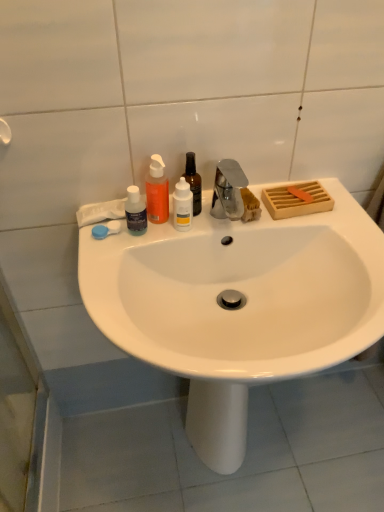
This screenshot has height=512, width=384. Find the location of `transparent plastic bottle at center, arranged as the 4th bottle when viewed from the left`. transparent plastic bottle at center, arranged as the 4th bottle when viewed from the left is located at coordinates [193, 182].

This screenshot has height=512, width=384. Describe the element at coordinates (193, 182) in the screenshot. I see `transparent plastic bottle at center, the first bottle in the right-to-left sequence` at that location.

Looking at this image, how much space does white matte bottle at center, which is counted as the 3th bottle, starting from the left, occupy horizontally?

white matte bottle at center, which is counted as the 3th bottle, starting from the left, is 1.67 inches wide.

Measure the distance between white glossy sink at center and camera.

white glossy sink at center is 59.67 centimeters away from camera.

What is the approximate width of matte black bottle at left, the 4th bottle positioned from the right?

matte black bottle at left, the 4th bottle positioned from the right, is 1.65 inches in width.

This screenshot has width=384, height=512. What are the coordinates of `blue plastic soap at left` in the screenshot? It's located at (106, 229).

Looking at this image, is white matte bottle at center, which is counted as the 3th bottle, starting from the left, positioned far away from translucent orange liquid at upper center, which is counted as the second bottle, starting from the left?

No, white matte bottle at center, which is counted as the 3th bottle, starting from the left, is not far away from translucent orange liquid at upper center, which is counted as the second bottle, starting from the left.

Is white matte bottle at center, which is counted as the 3th bottle, starting from the left, smaller than translucent orange liquid at upper center, which is counted as the second bottle, starting from the left?

Yes, white matte bottle at center, which is counted as the 3th bottle, starting from the left, is smaller than translucent orange liquid at upper center, which is counted as the second bottle, starting from the left.

Does white matte bottle at center, which is counted as the 3th bottle, starting from the left, appear on the right side of translucent orange liquid at upper center, which is counted as the second bottle, starting from the left?

Yes, white matte bottle at center, which is counted as the 3th bottle, starting from the left, is to the right of translucent orange liquid at upper center, which is counted as the second bottle, starting from the left.

From the image's perspective, which one is positioned higher, white matte bottle at center, which is counted as the second bottle, starting from the right, or translucent orange liquid at upper center, which is the third bottle in right-to-left order?

From the image's view, translucent orange liquid at upper center, which is the third bottle in right-to-left order, is above.

Is white glossy sink at center positioned beyond the bounds of white matte bottle at center, which is counted as the second bottle, starting from the right?

Yes, white glossy sink at center is located beyond the bounds of white matte bottle at center, which is counted as the second bottle, starting from the right.

In terms of width, does white glossy sink at center look wider or thinner when compared to white matte bottle at center, which is counted as the second bottle, starting from the right?

Clearly, white glossy sink at center has more width compared to white matte bottle at center, which is counted as the second bottle, starting from the right.

From a real-world perspective, is white glossy sink at center physically above white matte bottle at center, which is counted as the second bottle, starting from the right?

Actually, white glossy sink at center is physically below white matte bottle at center, which is counted as the second bottle, starting from the right, in the real world.

Considering the sizes of objects white glossy sink at center and white matte bottle at center, which is counted as the second bottle, starting from the right, in the image provided, who is taller, white glossy sink at center or white matte bottle at center, which is counted as the second bottle, starting from the right,?

With more height is white glossy sink at center.

Can you confirm if matte black bottle at left, the 4th bottle positioned from the right, is positioned to the right of transparent plastic bottle at center, arranged as the 4th bottle when viewed from the left?

No, matte black bottle at left, the 4th bottle positioned from the right, is not to the right of transparent plastic bottle at center, arranged as the 4th bottle when viewed from the left.

Is matte black bottle at left, which is the 1th bottle in left-to-right order, behind transparent plastic bottle at center, the first bottle in the right-to-left sequence?

No, matte black bottle at left, which is the 1th bottle in left-to-right order, is closer to the viewer.

In the scene shown: Considering the relative sizes of matte black bottle at left, which is the 1th bottle in left-to-right order, and transparent plastic bottle at center, the first bottle in the right-to-left sequence, in the image provided, is matte black bottle at left, which is the 1th bottle in left-to-right order, smaller than transparent plastic bottle at center, the first bottle in the right-to-left sequence,?

Yes.

From the picture: Can you confirm if blue plastic soap at left is shorter than white matte bottle at center, which is counted as the second bottle, starting from the right?

Yes.

Which of these two, blue plastic soap at left or white matte bottle at center, which is counted as the second bottle, starting from the right, is thinner?

blue plastic soap at left.

Are blue plastic soap at left and white matte bottle at center, which is counted as the 3th bottle, starting from the left, far apart?

No, there isn't a large distance between blue plastic soap at left and white matte bottle at center, which is counted as the 3th bottle, starting from the left.

Considering the relative sizes of blue plastic soap at left and white matte bottle at center, which is counted as the second bottle, starting from the right, in the image provided, is blue plastic soap at left smaller than white matte bottle at center, which is counted as the second bottle, starting from the right,?

Indeed, blue plastic soap at left has a smaller size compared to white matte bottle at center, which is counted as the second bottle, starting from the right.

Which object is further away from the camera taking this photo, blue plastic soap at left or matte black bottle at left, which is the 1th bottle in left-to-right order?

blue plastic soap at left.

Is blue plastic soap at left facing away from matte black bottle at left, the 4th bottle positioned from the right?

blue plastic soap at left is not turned away from matte black bottle at left, the 4th bottle positioned from the right.

Is blue plastic soap at left wider or thinner than matte black bottle at left, the 4th bottle positioned from the right?

blue plastic soap at left is thinner than matte black bottle at left, the 4th bottle positioned from the right.

From a real-world perspective, is blue plastic soap at left on matte black bottle at left, the 4th bottle positioned from the right?

Actually, blue plastic soap at left is physically below matte black bottle at left, the 4th bottle positioned from the right, in the real world.

Is there a large distance between matte black bottle at left, which is the 1th bottle in left-to-right order, and blue plastic soap at left?

No.

Relative to blue plastic soap at left, is matte black bottle at left, the 4th bottle positioned from the right, in front or behind?

matte black bottle at left, the 4th bottle positioned from the right, is in front of blue plastic soap at left.

Is matte black bottle at left, which is the 1th bottle in left-to-right order, positioned with its back to blue plastic soap at left?

matte black bottle at left, which is the 1th bottle in left-to-right order, does not have its back to blue plastic soap at left.

Who is shorter, matte black bottle at left, which is the 1th bottle in left-to-right order, or blue plastic soap at left?

With less height is blue plastic soap at left.

Considering the positions of objects matte black bottle at left, the 4th bottle positioned from the right, and white matte bottle at center, which is counted as the second bottle, starting from the right, in the image provided, who is more to the right, matte black bottle at left, the 4th bottle positioned from the right, or white matte bottle at center, which is counted as the second bottle, starting from the right,?

white matte bottle at center, which is counted as the second bottle, starting from the right, is more to the right.

Is matte black bottle at left, which is the 1th bottle in left-to-right order, not within white matte bottle at center, which is counted as the second bottle, starting from the right?

matte black bottle at left, which is the 1th bottle in left-to-right order, lies outside white matte bottle at center, which is counted as the second bottle, starting from the right,'s area.

Which of these two, matte black bottle at left, the 4th bottle positioned from the right, or white matte bottle at center, which is counted as the second bottle, starting from the right, is bigger?

white matte bottle at center, which is counted as the second bottle, starting from the right.

Between matte black bottle at left, which is the 1th bottle in left-to-right order, and white matte bottle at center, which is counted as the 3th bottle, starting from the left, which one has larger width?

With larger width is white matte bottle at center, which is counted as the 3th bottle, starting from the left.

The width and height of the screenshot is (384, 512). In order to click on bottle that is the 1st one when counting upward from the white matte bottle at center, which is counted as the 3th bottle, starting from the left (from the image's perspective) in this screenshot , I will do `click(157, 191)`.

Where is `sink directly beneath the white matte bottle at center, which is counted as the 3th bottle, starting from the left (from a real-world perspective)`? sink directly beneath the white matte bottle at center, which is counted as the 3th bottle, starting from the left (from a real-world perspective) is located at coordinates (238, 306).

From the image, which object appears to be farther from transparent plastic bottle at center, the first bottle in the right-to-left sequence, white glossy sink at center or matte black bottle at left, the 4th bottle positioned from the right?

white glossy sink at center is positioned further to the anchor transparent plastic bottle at center, the first bottle in the right-to-left sequence.

In the scene shown: When comparing their distances from blue plastic soap at left, does white matte bottle at center, which is counted as the 3th bottle, starting from the left, or translucent orange liquid at upper center, which is counted as the second bottle, starting from the left, seem closer?

translucent orange liquid at upper center, which is counted as the second bottle, starting from the left, is closer to blue plastic soap at left.

Looking at the image, which one is located further to blue plastic soap at left, transparent plastic bottle at center, arranged as the 4th bottle when viewed from the left, or matte black bottle at left, the 4th bottle positioned from the right?

Among the two, transparent plastic bottle at center, arranged as the 4th bottle when viewed from the left, is located further to blue plastic soap at left.

When comparing their distances from white glossy sink at center, does translucent orange liquid at upper center, which is the third bottle in right-to-left order, or matte black bottle at left, the 4th bottle positioned from the right, seem closer?

translucent orange liquid at upper center, which is the third bottle in right-to-left order, is positioned closer to the anchor white glossy sink at center.

Based on the photo, when comparing their distances from white glossy sink at center, does matte black bottle at left, the 4th bottle positioned from the right, or white matte bottle at center, which is counted as the second bottle, starting from the right, seem closer?

white matte bottle at center, which is counted as the second bottle, starting from the right.

Considering their positions, is white matte bottle at center, which is counted as the 3th bottle, starting from the left, positioned further to white glossy sink at center than transparent plastic bottle at center, the first bottle in the right-to-left sequence?

transparent plastic bottle at center, the first bottle in the right-to-left sequence, is positioned further to the anchor white glossy sink at center.

Considering their positions, is transparent plastic bottle at center, arranged as the 4th bottle when viewed from the left, positioned closer to matte black bottle at left, the 4th bottle positioned from the right, than white glossy sink at center?

Based on the image, transparent plastic bottle at center, arranged as the 4th bottle when viewed from the left, appears to be nearer to matte black bottle at left, the 4th bottle positioned from the right.

Estimate the real-world distances between objects in this image. Which object is closer to matte black bottle at left, the 4th bottle positioned from the right, translucent orange liquid at upper center, which is counted as the second bottle, starting from the left, or white matte bottle at center, which is counted as the 3th bottle, starting from the left?

translucent orange liquid at upper center, which is counted as the second bottle, starting from the left.

Where is `bottle situated between translucent orange liquid at upper center, which is counted as the second bottle, starting from the left, and transparent plastic bottle at center, the first bottle in the right-to-left sequence, from left to right`? Image resolution: width=384 pixels, height=512 pixels. bottle situated between translucent orange liquid at upper center, which is counted as the second bottle, starting from the left, and transparent plastic bottle at center, the first bottle in the right-to-left sequence, from left to right is located at coordinates (182, 205).

Image resolution: width=384 pixels, height=512 pixels. What are the coordinates of `bottle between matte black bottle at left, which is the 1th bottle in left-to-right order, and white matte bottle at center, which is counted as the 3th bottle, starting from the left, from left to right` in the screenshot? It's located at (157, 191).

This screenshot has height=512, width=384. I want to click on bottle between blue plastic soap at left and translucent orange liquid at upper center, which is the third bottle in right-to-left order, in the horizontal direction, so click(x=135, y=211).

In order to click on bottle between white glossy sink at center and translucent orange liquid at upper center, which is counted as the second bottle, starting from the left, along the z-axis in this screenshot , I will do `click(135, 211)`.